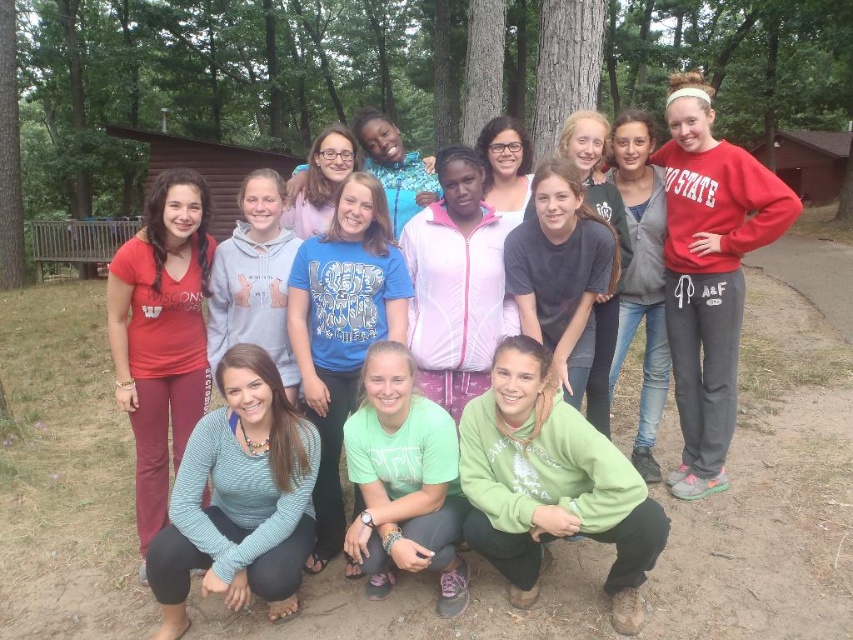
You are a photographer trying to capture a group photo of the campers. You notice the matte gray hoodie at center and the green fleece jacket at center. Which piece of clothing should you focus on first if you want to ensure both are in the frame?

The green fleece jacket at center is to the left of the matte gray hoodie at center, so focusing on the green fleece jacket at center first will help ensure both are in the frame.